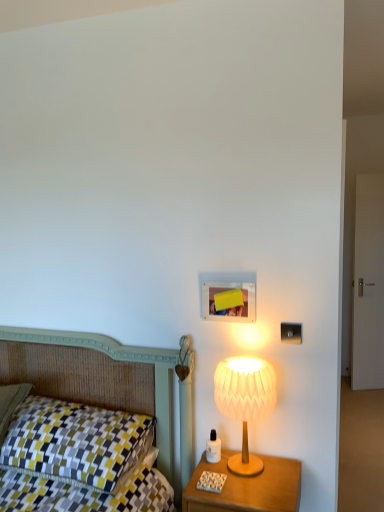
What is the approximate height of checkered fabric pillow at left?

The height of checkered fabric pillow at left is 9.32 inches.

Measure the distance between wooden nightstand at right and camera.

wooden nightstand at right and camera are 5.00 feet apart.

Measure the distance between point (x=218, y=366) and camera.

Point (x=218, y=366) and camera are 1.73 meters apart.

What is the approximate height of white paper lampshade at right?

white paper lampshade at right is 45.36 centimeters in height.

The width and height of the screenshot is (384, 512). In order to click on checkered fabric pillow at left in this screenshot , I will do `click(75, 442)`.

Is wooden nightstand at right positioned beyond the bounds of checkered fabric pillow at left?

That's correct, wooden nightstand at right is outside of checkered fabric pillow at left.

Considering the relative positions of wooden nightstand at right and checkered fabric pillow at left in the image provided, is wooden nightstand at right to the left or to the right of checkered fabric pillow at left?

From the image, it's evident that wooden nightstand at right is to the right of checkered fabric pillow at left.

Which of these two, wooden nightstand at right or checkered fabric pillow at left, is wider?

With larger width is checkered fabric pillow at left.

Considering the points (198, 463) and (82, 430), which point is in front, point (198, 463) or point (82, 430)?

The point (82, 430) is closer.

You are a GUI agent. You are given a task and a screenshot of the screen. Output one action in this format:
    pyautogui.click(x=<x>, y=<y>)
    Task: Click on the nightstand that is under the checkered fabric pillow at left (from a real-world perspective)
    Image resolution: width=384 pixels, height=512 pixels.
    Given the screenshot: What is the action you would take?
    pyautogui.click(x=247, y=487)

Looking at this image, is the position of checkered fabric pillow at left more distant than that of wooden nightstand at right?

Yes.

Consider the image. From the image's perspective, between checkered fabric pillow at left and wooden nightstand at right, who is located below?

From the image's view, wooden nightstand at right is below.

Is point (143, 450) closer or farther from the camera than point (268, 467)?

Point (143, 450) appears to be farther away from the viewer than point (268, 467).

Do you think wooden nightstand at right is within white paper lampshade at right, or outside of it?

The correct answer is: outside.

Can you confirm if wooden nightstand at right is positioned to the left of white paper lampshade at right?

Yes.

Considering the sizes of wooden nightstand at right and white paper lampshade at right in the image, is wooden nightstand at right wider or thinner than white paper lampshade at right?

Clearly, wooden nightstand at right has more width compared to white paper lampshade at right.

Who is more distant, white paper lampshade at right or wooden nightstand at right?

white paper lampshade at right is more distant.

Is point (233, 469) closer to viewer compared to point (187, 510)?

No, it is behind (187, 510).

From a real-world perspective, is white paper lampshade at right physically below wooden nightstand at right?

No.

Is white paper lampshade at right turned away from wooden nightstand at right?

No.

Which object is closer to the camera taking this photo, checkered fabric pillow at left or white paper lampshade at right?

checkered fabric pillow at left is in front.

Can you tell me how much checkered fabric pillow at left and white paper lampshade at right differ in facing direction?

0.645 degrees separate the facing orientations of checkered fabric pillow at left and white paper lampshade at right.

How distant is checkered fabric pillow at left from white paper lampshade at right?

The distance of checkered fabric pillow at left from white paper lampshade at right is 22.34 inches.

Is point (96, 443) closer or farther from the camera than point (252, 367)?

Clearly, point (96, 443) is more distant from the camera than point (252, 367).

Can you confirm if white paper lampshade at right is bigger than checkered fabric pillow at left?

Incorrect, white paper lampshade at right is not larger than checkered fabric pillow at left.

From a real-world perspective, is white paper lampshade at right located higher than checkered fabric pillow at left?

Correct, in the physical world, white paper lampshade at right is higher than checkered fabric pillow at left.

Considering the relative sizes of white paper lampshade at right and checkered fabric pillow at left in the image provided, is white paper lampshade at right wider than checkered fabric pillow at left?

Incorrect, the width of white paper lampshade at right does not surpass that of checkered fabric pillow at left.

Is white paper lampshade at right in front of or behind checkered fabric pillow at left in the image?

white paper lampshade at right is behind checkered fabric pillow at left.

Where is `nightstand below the checkered fabric pillow at left (from the image's perspective)`? This screenshot has width=384, height=512. nightstand below the checkered fabric pillow at left (from the image's perspective) is located at coordinates (247, 487).

I want to click on pillow above the wooden nightstand at right (from a real-world perspective), so click(x=75, y=442).

Looking at the image, which one is located closer to wooden nightstand at right, checkered fabric pillow at left or white paper lampshade at right?

white paper lampshade at right is closer to wooden nightstand at right.

Based on their spatial positions, is checkered fabric pillow at left or wooden nightstand at right further from white paper lampshade at right?

Among the two, checkered fabric pillow at left is located further to white paper lampshade at right.

Which object lies nearer to the anchor point checkered fabric pillow at left, white paper lampshade at right or wooden nightstand at right?

wooden nightstand at right.

When comparing their distances from wooden nightstand at right, does white paper lampshade at right or checkered fabric pillow at left seem further?

checkered fabric pillow at left is further to wooden nightstand at right.

From the picture: Based on their spatial positions, is wooden nightstand at right or white paper lampshade at right closer to checkered fabric pillow at left?

The object closer to checkered fabric pillow at left is wooden nightstand at right.

Based on their spatial positions, is wooden nightstand at right or checkered fabric pillow at left further from white paper lampshade at right?

checkered fabric pillow at left.

Where is `nightstand situated between checkered fabric pillow at left and white paper lampshade at right from left to right`? This screenshot has width=384, height=512. nightstand situated between checkered fabric pillow at left and white paper lampshade at right from left to right is located at coordinates (247, 487).